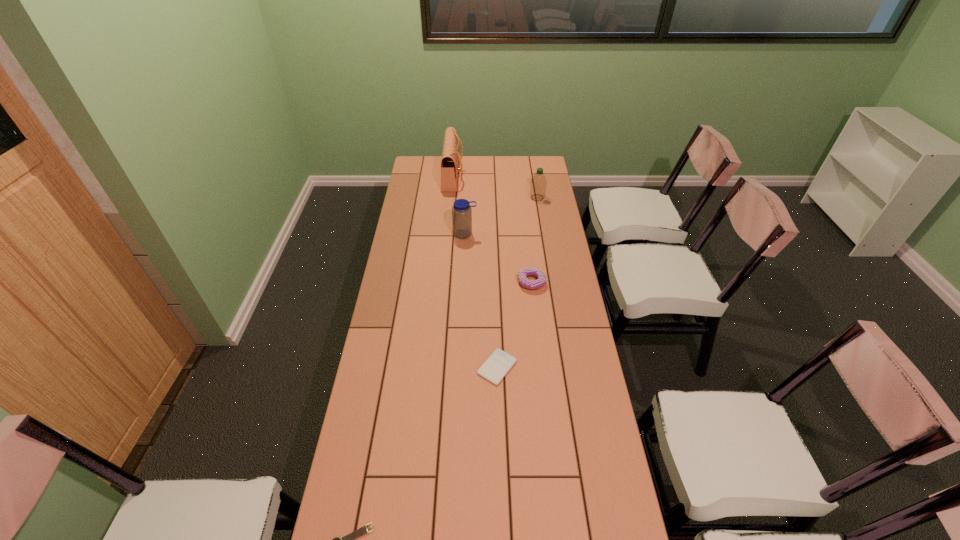
Find the location of `vacant area situated on the front-facing side of the farthest object`. vacant area situated on the front-facing side of the farthest object is located at coordinates (537, 176).

The image size is (960, 540). What are the coordinates of `vacant space situated 0.390m with a carrying loop on the side of the nearer water bottle` in the screenshot? It's located at (462, 303).

The image size is (960, 540). In order to click on vacant space located on the front of the farther water bottle in this screenshot , I will do `click(541, 225)`.

This screenshot has height=540, width=960. I want to click on free space located on the left of the third nearest object, so click(493, 282).

Find the location of `free space located on the back of the second nearest object`. free space located on the back of the second nearest object is located at coordinates (496, 334).

The image size is (960, 540). I want to click on object that is at the far edge, so click(450, 159).

Locate an element on the screen. The width and height of the screenshot is (960, 540). water bottle at the right edge is located at coordinates (538, 183).

Locate an element on the screen. The image size is (960, 540). doughnut at the right edge is located at coordinates (529, 271).

Where is `vacant space at the far edge of the desktop`? The height and width of the screenshot is (540, 960). vacant space at the far edge of the desktop is located at coordinates (503, 165).

The width and height of the screenshot is (960, 540). In order to click on vacant space at the left edge of the desktop in this screenshot , I will do pos(388,288).